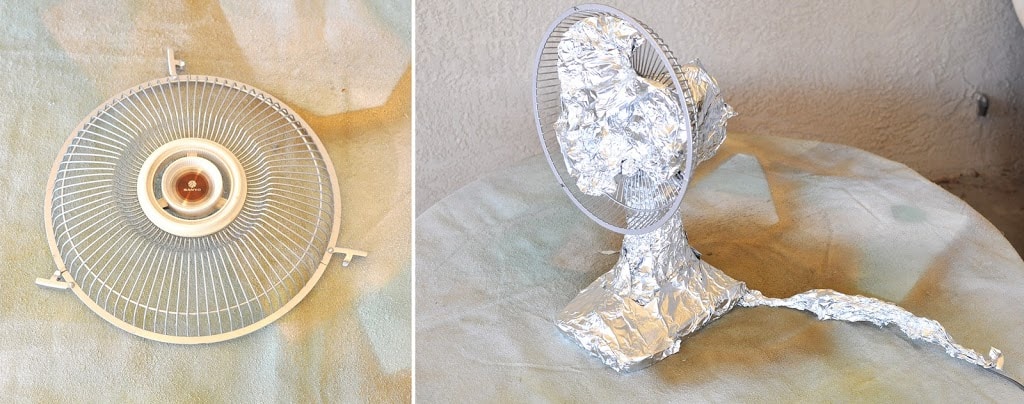
Locate an element on the screen. The width and height of the screenshot is (1024, 404). blades of fan is located at coordinates (593, 71).